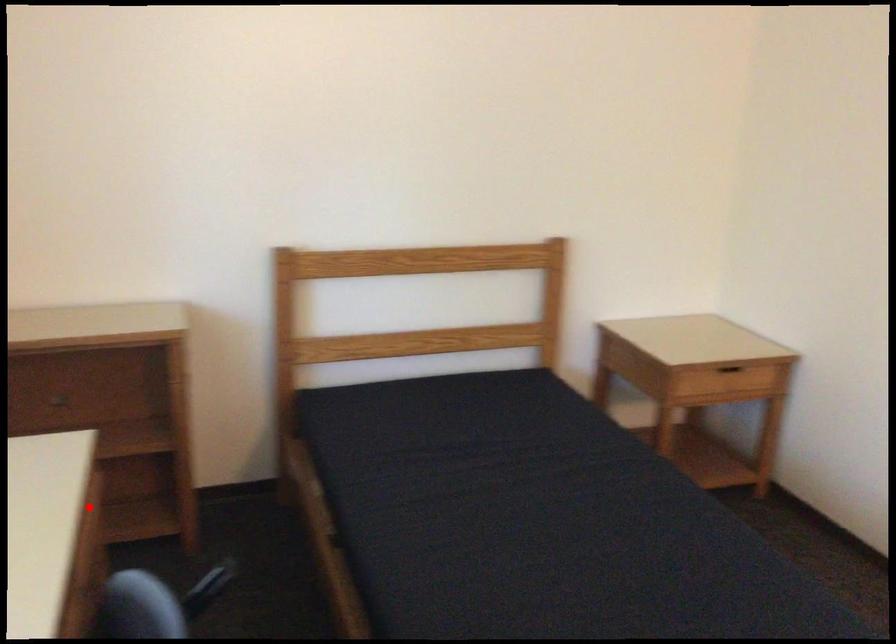
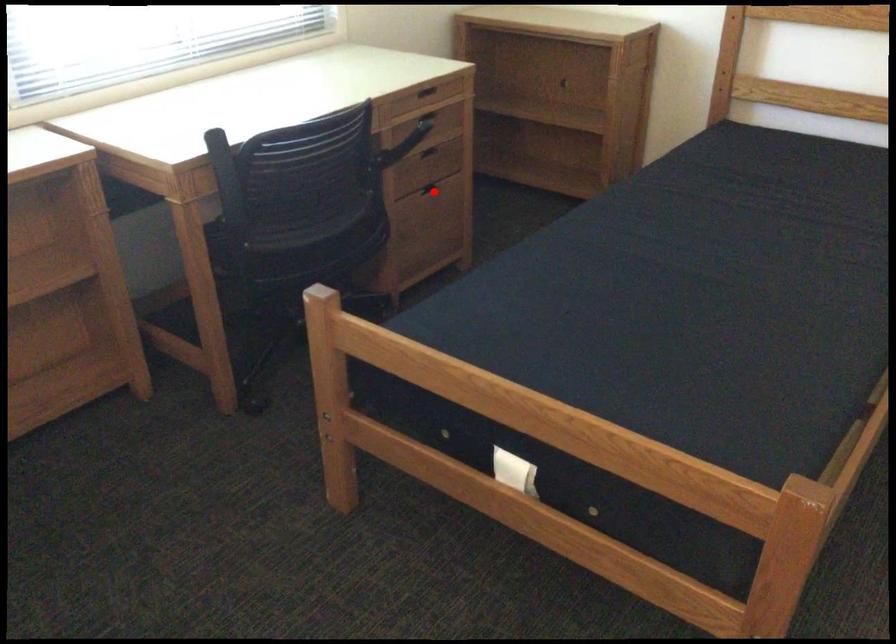
I am providing you with two images of the same scene from different viewpoints. A red point is marked on the first image and another point is marked on the second image. Does the point marked in image1 correspond to the same location as the one in image2?

No